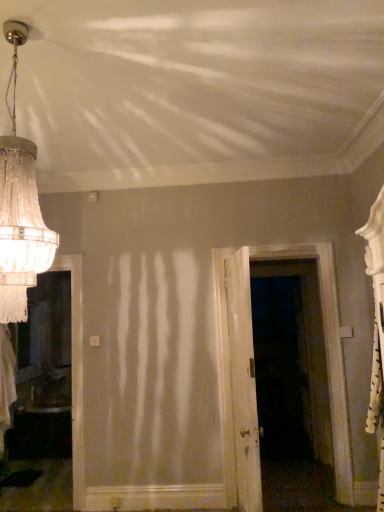
Question: From the image's perspective, is white wood door at center, the second door positioned from the right, under crystal glass chandelier at upper left?

Choices:
 (A) no
 (B) yes

Answer: (B)

Question: Considering the relative sizes of white wood door at center, the second door positioned from the right, and crystal glass chandelier at upper left in the image provided, is white wood door at center, the second door positioned from the right, shorter than crystal glass chandelier at upper left?

Choices:
 (A) no
 (B) yes

Answer: (A)

Question: Considering the relative sizes of white wood door at center, which is counted as the first door, starting from the left, and crystal glass chandelier at upper left in the image provided, is white wood door at center, which is counted as the first door, starting from the left, smaller than crystal glass chandelier at upper left?

Choices:
 (A) no
 (B) yes

Answer: (A)

Question: Considering the relative sizes of white wood door at center, the second door positioned from the right, and crystal glass chandelier at upper left in the image provided, is white wood door at center, the second door positioned from the right, thinner than crystal glass chandelier at upper left?

Choices:
 (A) yes
 (B) no

Answer: (A)

Question: Does white wood door at center, the second door positioned from the right, have a greater width compared to crystal glass chandelier at upper left?

Choices:
 (A) no
 (B) yes

Answer: (A)

Question: From the image's perspective, is white wood door at center, the second door positioned from the right, over crystal glass chandelier at upper left?

Choices:
 (A) no
 (B) yes

Answer: (A)

Question: Does white wood door at center, the second door positioned from the right, have a larger size compared to white wooden door at center, acting as the second door starting from the left?

Choices:
 (A) yes
 (B) no

Answer: (B)

Question: Does white wood door at center, the second door positioned from the right, appear on the left side of white wooden door at center, acting as the second door starting from the left?

Choices:
 (A) yes
 (B) no

Answer: (A)

Question: Is white wood door at center, the second door positioned from the right, smaller than white wooden door at center, acting as the second door starting from the left?

Choices:
 (A) yes
 (B) no

Answer: (A)

Question: Is white wood door at center, the second door positioned from the right, further to the viewer compared to white wooden door at center, acting as the second door starting from the left?

Choices:
 (A) no
 (B) yes

Answer: (A)

Question: Is white wood door at center, the second door positioned from the right, with white wooden door at center, acting as the second door starting from the left?

Choices:
 (A) yes
 (B) no

Answer: (B)

Question: Considering the relative positions of white wood door at center, which is counted as the first door, starting from the left, and white wooden door at center, acting as the second door starting from the left, in the image provided, is white wood door at center, which is counted as the first door, starting from the left, to the right of white wooden door at center, acting as the second door starting from the left, from the viewer's perspective?

Choices:
 (A) no
 (B) yes

Answer: (A)

Question: Does white wooden door at center, which ranks as the 1th door in right-to-left order, have a smaller size compared to crystal glass chandelier at upper left?

Choices:
 (A) no
 (B) yes

Answer: (A)